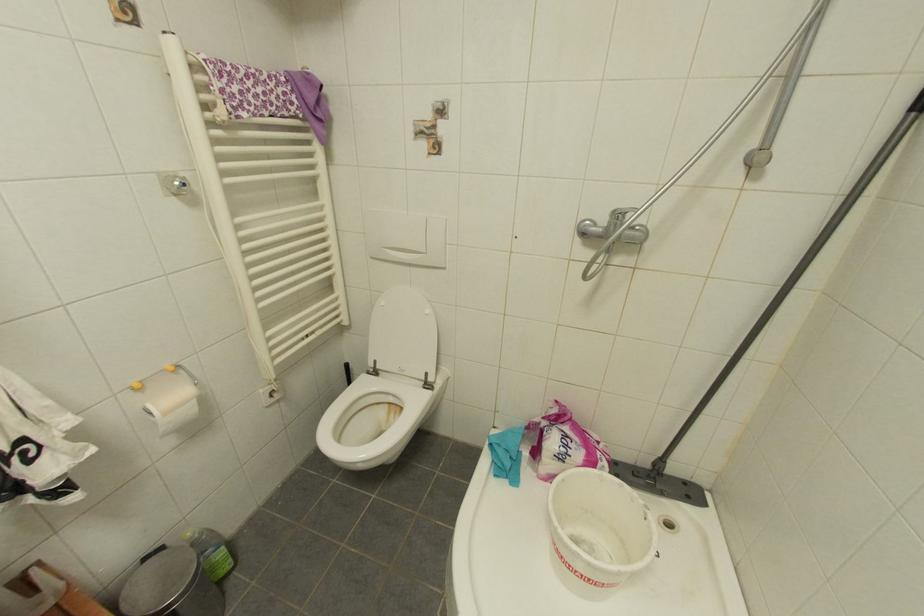
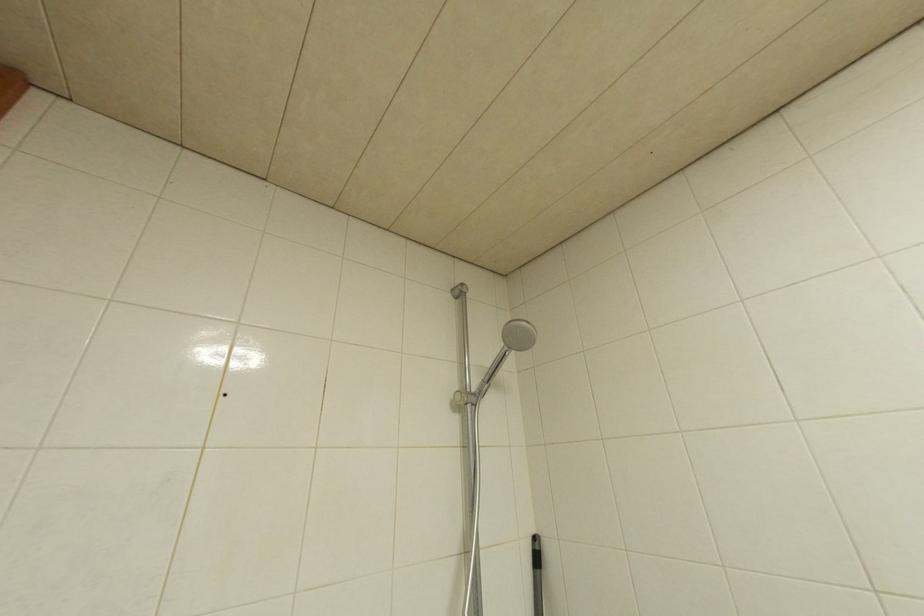
Based on the continuous images, in which direction is the camera rotating?

The camera's rotation is toward right-up.